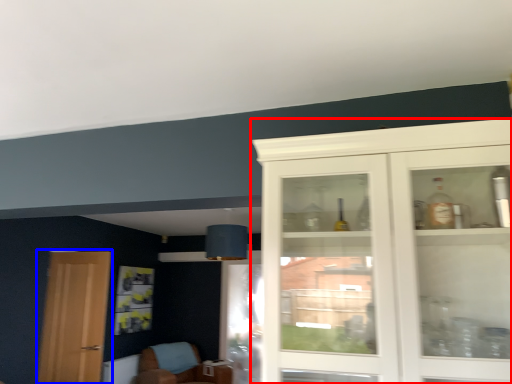
Question: Among these objects, which one is nearest to the camera, cabinetry (highlighted by a red box) or door (highlighted by a blue box)?

Choices:
 (A) cabinetry
 (B) door

Answer: (A)